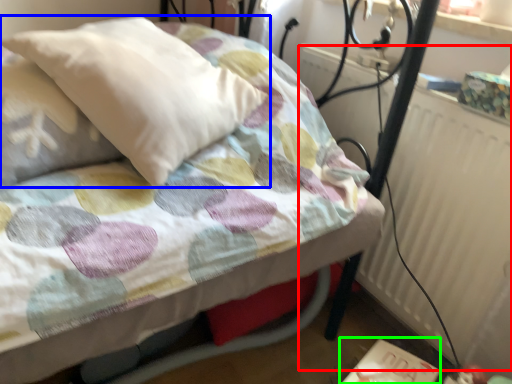
Question: Based on their relative distances, which object is farther from radiator (highlighted by a red box)? Choose from pillow (highlighted by a blue box) and table (highlighted by a green box).

Choices:
 (A) pillow
 (B) table

Answer: (A)